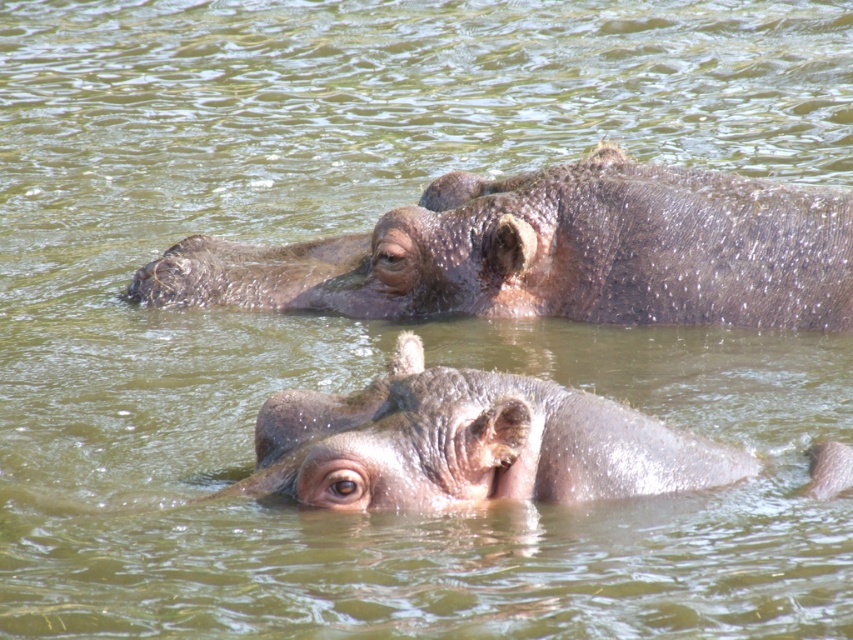
You are a wildlife photographer trying to capture a photo of the wet brown hippo at upper center and the gray matte elephant at center. If you want to frame both animals in your shot, which one should you focus on first to ensure they are both in the frame?

You should focus on the wet brown hippo at upper center first because it is wider than the gray matte elephant at center, so centering it first will help ensure both fit in the frame.

You are a wildlife photographer trying to capture a photo of both the wet brown hippo at upper center and the gray matte elephant at center. Based on their heights, which animal should you focus on first to ensure they are both in frame?

You should focus on the wet brown hippo at upper center first because it is taller than the gray matte elephant at center, ensuring both are in frame by centering on the taller one.

You are a wildlife photographer trying to capture a clear photo of the gray matte elephant at center. However, the wet brown hippo at upper center is blocking your view. Can you move to the left to get a better shot without the hippo in the way?

The wet brown hippo at upper center is closer to you than the gray matte elephant at center. Moving to the left might not help because the hippo is in front of the elephant. To get a clear shot of the gray matte elephant at center, you need to move around the hippo or wait for it to move aside.